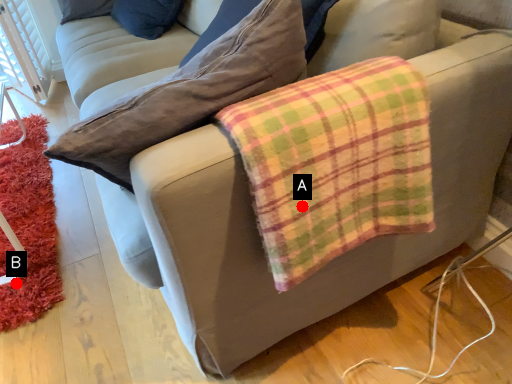
Question: Two points are circled on the image, labeled by A and B beside each circle. Which point is farther from the camera taking this photo?

Choices:
 (A) A is further
 (B) B is further

Answer: (B)